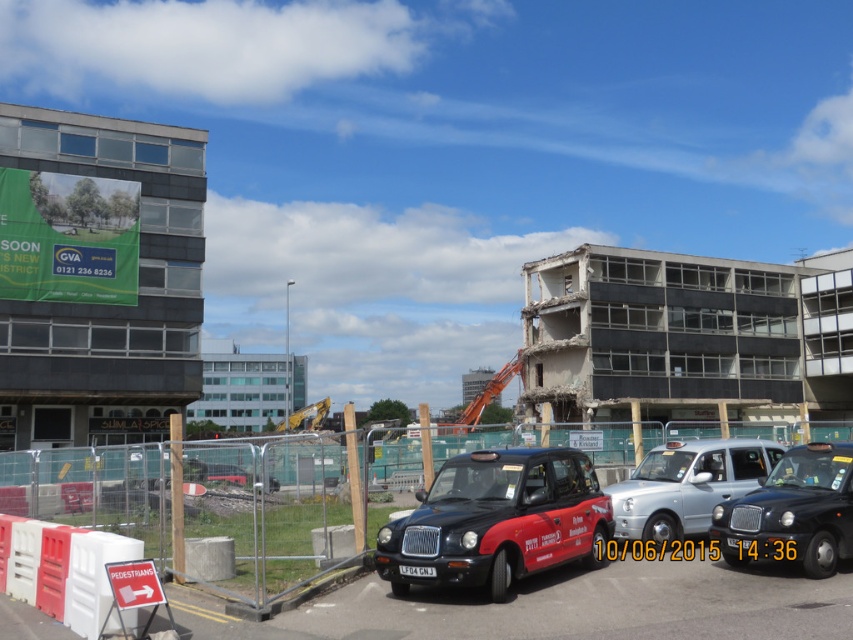
You are a delivery driver needing to park your vehicle in a low clearance garage. You see the matte black taxi at center and the silver metallic taxi at center in the parking lot. Which vehicle should you avoid to ensure your delivery van, which is 1.8 meters tall, can fit through the garage entrance?

The matte black taxi at center is much taller than the silver metallic taxi at center, so you should avoid the matte black taxi at center to ensure there is enough clearance for your delivery van.

You are a pedestrian trying to cross the street where the matte black taxi at center and the silver metallic taxi at center are parked. Based on their positions, which taxi is closer to the curb?

The matte black taxi at center is closer to the curb because it is positioned below the silver metallic taxi at center, indicating it is lower in the image and thus nearer to the street level.

You are a delivery person standing at the construction site fence. You need to locate two points marked on the map. The first point is at coordinates point (572, 547) and the second is at point (595, 540). Which point is closer to you?

Point (572, 547) is in front of point (595, 540), so the first point is closer to you.